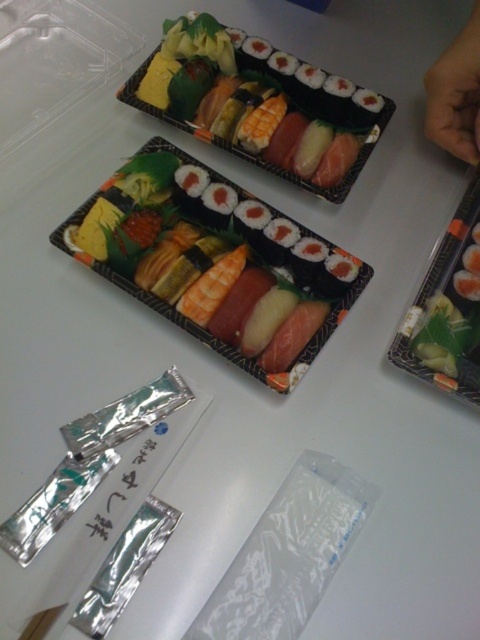
Question: Which of the following is the farthest from the observer?

Choices:
 (A) skinny hand at upper right
 (B) transparent plastic bag at lower center

Answer: (A)

Question: Which of the following is the farthest from the observer?

Choices:
 (A) wooden chopsticks at lower left
 (B) skinny hand at upper right

Answer: (B)

Question: Does shiny plastic sushi at upper center have a smaller size compared to skinny hand at upper right?

Choices:
 (A) yes
 (B) no

Answer: (B)

Question: Can you confirm if shiny black sushi at center is bigger than shiny plastic sushi at upper center?

Choices:
 (A) no
 (B) yes

Answer: (B)

Question: Is shiny black sushi at center smaller than shiny plastic sushi at upper center?

Choices:
 (A) yes
 (B) no

Answer: (B)

Question: Which of the following is the closest to the observer?

Choices:
 (A) skinny hand at upper right
 (B) wooden chopsticks at lower left
 (C) transparent plastic bag at lower center

Answer: (B)